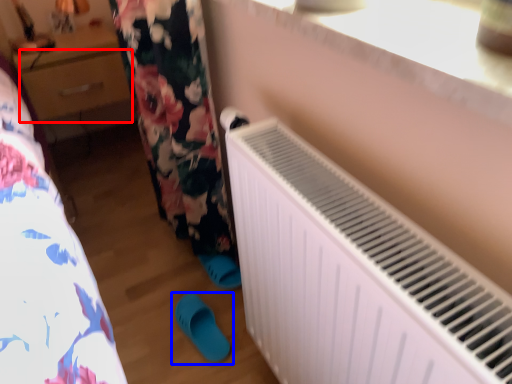
Question: Which object is closer to the camera taking this photo, drawer (highlighted by a red box) or footwear (highlighted by a blue box)?

Choices:
 (A) drawer
 (B) footwear

Answer: (B)